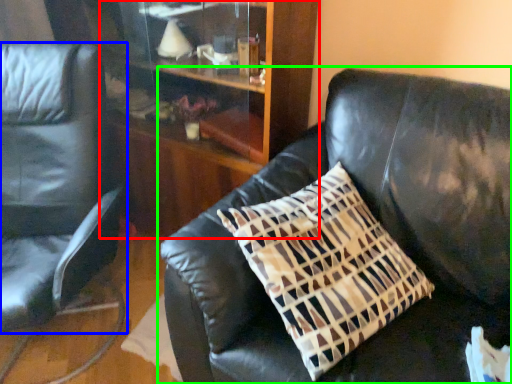
Question: Estimate the real-world distances between objects in this image. Which object is farther from dresser (highlighted by a red box), chair (highlighted by a blue box) or studio couch (highlighted by a green box)?

Choices:
 (A) chair
 (B) studio couch

Answer: (A)